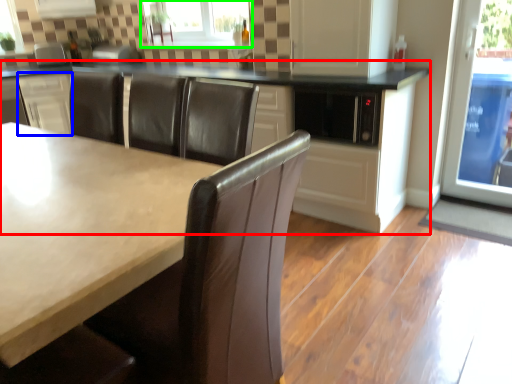
Question: Which object is the closest to the cabinetry (highlighted by a red box)? Choose among these: cabinetry (highlighted by a blue box) or window (highlighted by a green box).

Choices:
 (A) cabinetry
 (B) window

Answer: (B)